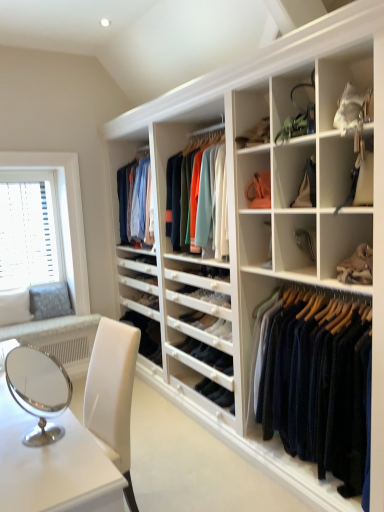
The width and height of the screenshot is (384, 512). Find the location of `blank space situated above white plastic blinds at left (from a real-world perspective)`. blank space situated above white plastic blinds at left (from a real-world perspective) is located at coordinates (25, 169).